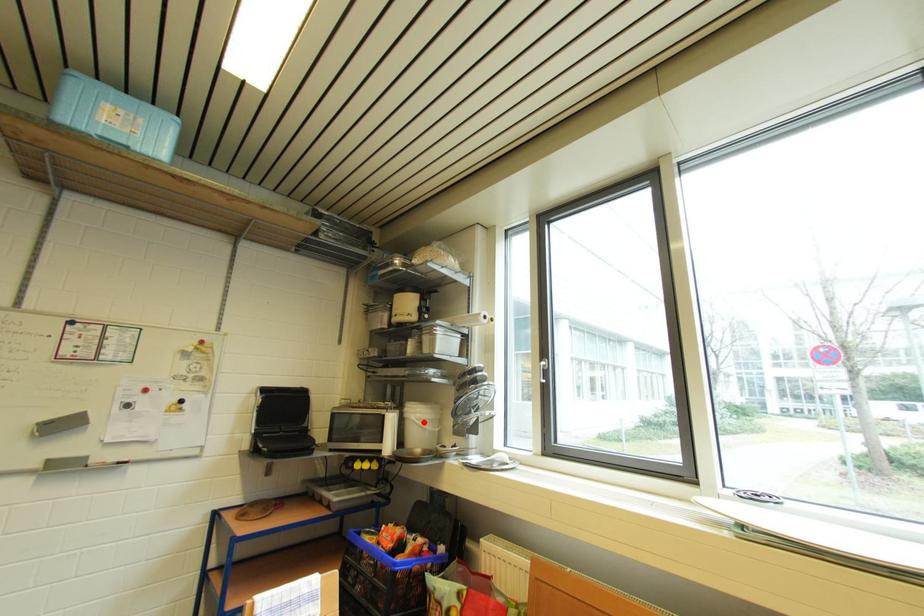
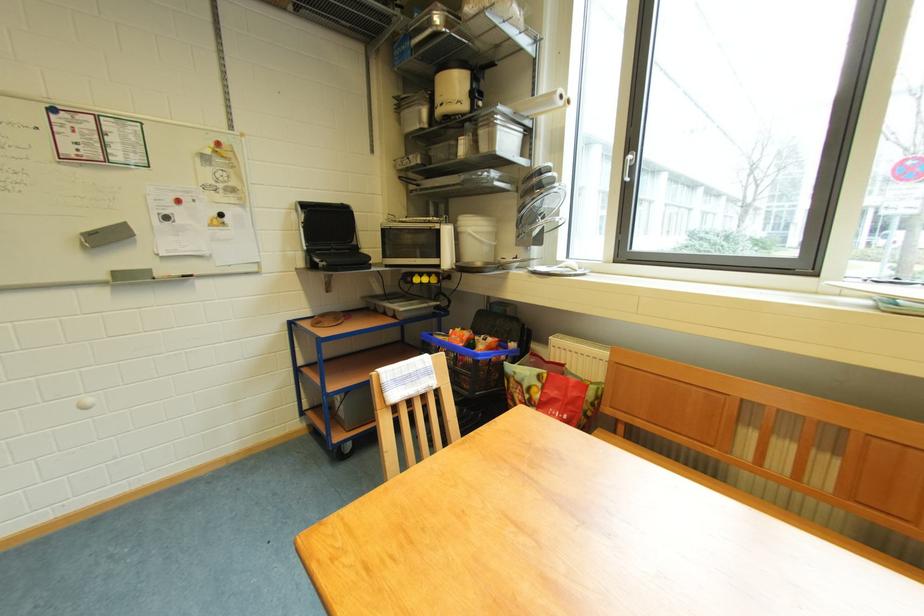
The point at the highlighted location is marked in the first image. Where is the corresponding point in the second image?

(481, 235)